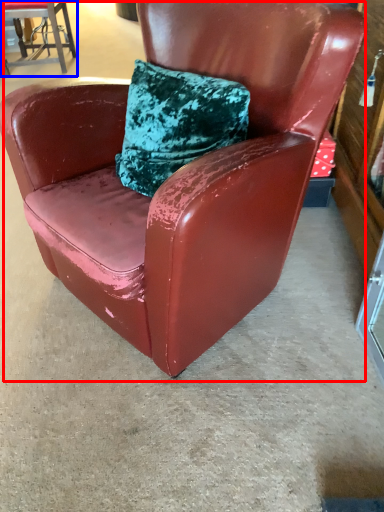
Question: Which point is closer to the camera, chair (highlighted by a red box) or chair (highlighted by a blue box)?

Choices:
 (A) chair
 (B) chair

Answer: (A)